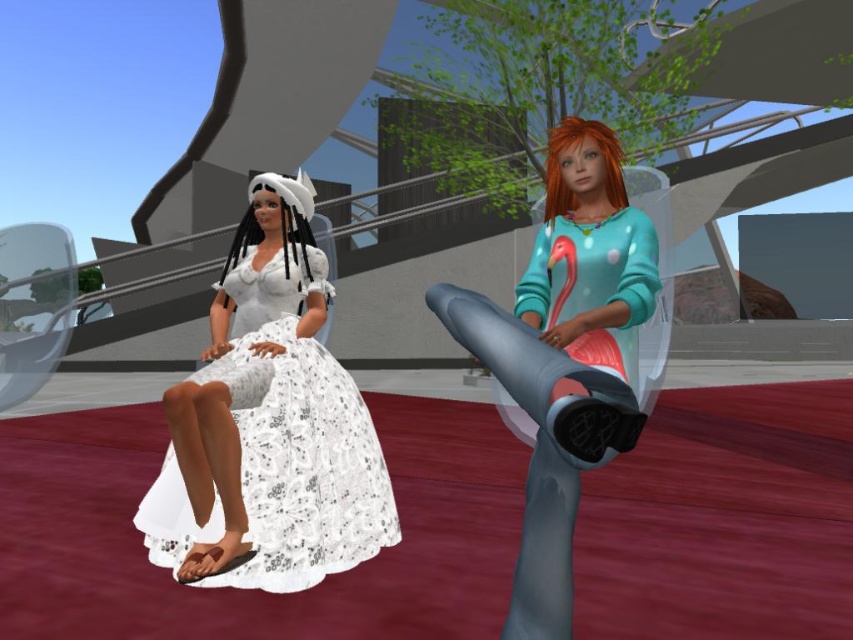
You are a game character trying to retrieve the teal matte sweater at center from behind the white lace dress at left. Can you move around the dress to reach it?

The teal matte sweater at center is behind the white lace dress at left, so you can move around the dress to reach it since it is positioned behind.

You are a fashion designer observing the two outfits in the image. The outfits are the white lace dress at left and the teal matte sweater at center. Which outfit is taller?

The white lace dress at left is taller than the teal matte sweater at center.

You see two characters in the image, one wearing a white lace dress at left and the other wearing a teal matte sweater at center. Which character is positioned to the left of the other?

The white lace dress at left is positioned on the left side of the teal matte sweater at center.